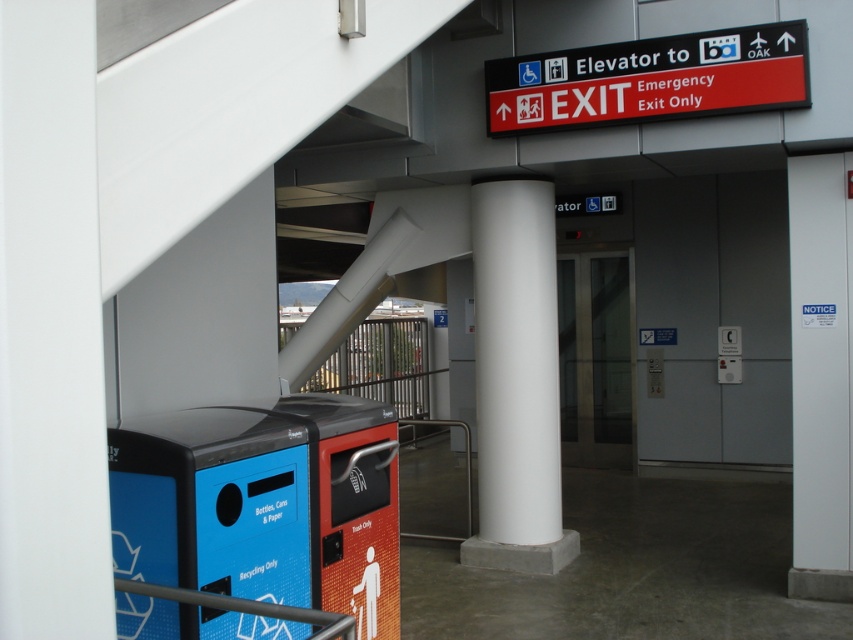
You are standing in the middle of the public space and want to exit through the doorway marked by the red plastic sign at upper right. Which direction should you move relative to the white smooth column at center to reach the doorway?

The white smooth column at center is to the left of the red plastic sign at upper right, so you should move to the right of the white smooth column at center to reach the doorway marked by the red plastic sign at upper right.

You are standing in the transportation hub and want to place a large poster on the wall at point (x=488, y=280). Can you reach it without any equipment?

The distance of point (x=488, y=280) from camera is 6.13 meters, so it is too far to reach without equipment like a ladder or extendable pole.

You are standing in the transportation hub and want to find the doorway that leads to the baggage claim area. You see a white smooth column at center and a red plastic sign at upper right. According to the scene, which object is closer to the doorway you need to go through?

The red plastic sign at upper right is closer to the doorway because it is located above the doorway, while the white smooth column at center is positioned below it.